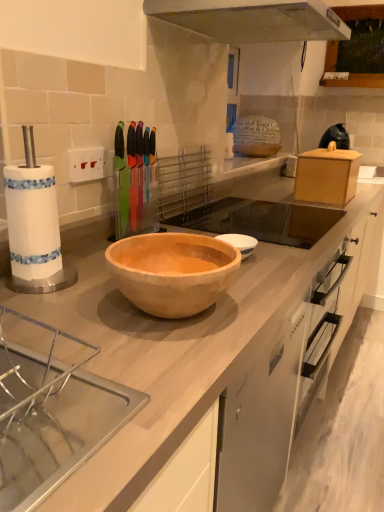
Question: Considering the positions of clear acrylic sink at lower left, the second sink viewed from the back, and stainless steel exhaust hood at upper center in the image, is clear acrylic sink at lower left, the second sink viewed from the back, wider or thinner than stainless steel exhaust hood at upper center?

Choices:
 (A) wide
 (B) thin

Answer: (B)

Question: From a real-world perspective, is clear acrylic sink at lower left, the second sink viewed from the back, above or below stainless steel exhaust hood at upper center?

Choices:
 (A) above
 (B) below

Answer: (B)

Question: Estimate the real-world distances between objects in this image. Which object is farther from the clear acrylic sink at lower left, which is the second sink in right-to-left order?

Choices:
 (A) black plastic kettle at upper right
 (B) wooden bowl at center, the second sink from the front
 (C) stainless steel exhaust hood at upper center

Answer: (A)

Question: Estimate the real-world distances between objects in this image. Which object is farther from the stainless steel exhaust hood at upper center?

Choices:
 (A) wooden bowl at center, arranged as the first sink when viewed from the top
 (B) black plastic kettle at upper right
 (C) clear acrylic sink at lower left, which is counted as the 1th sink, starting from the bottom

Answer: (C)